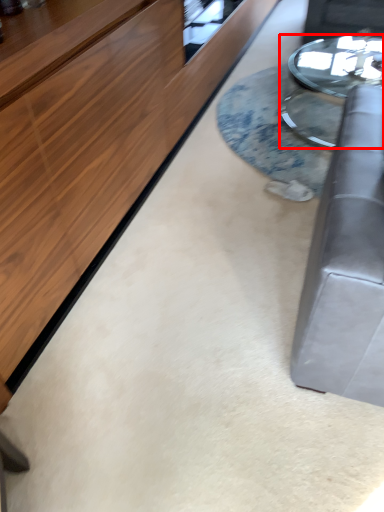
Question: From the image's perspective, considering the relative positions of table (annotated by the red box) and table in the image provided, where is table (annotated by the red box) located with respect to the staircase?

Choices:
 (A) above
 (B) below

Answer: (A)